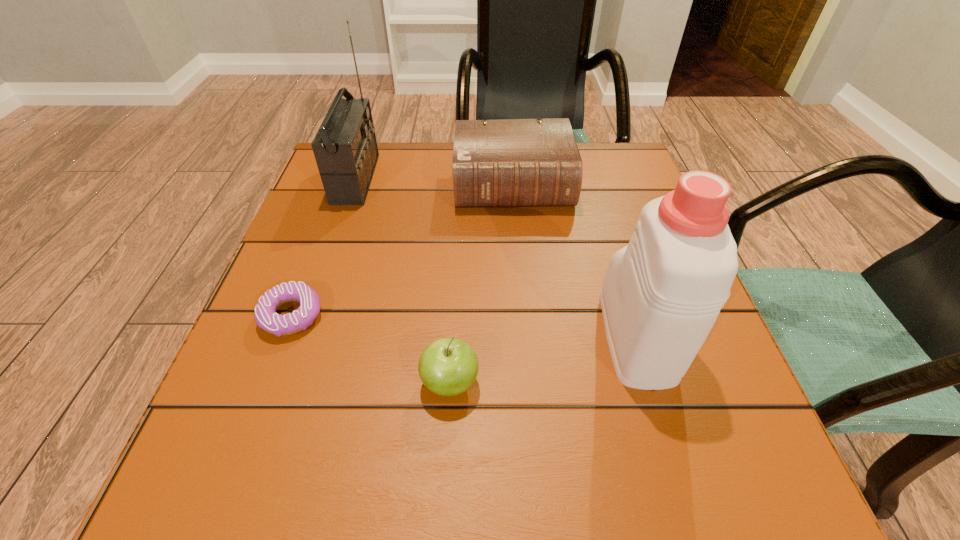
Locate an element on the screen. free point located 0.220m on the left of the apple is located at coordinates (270, 383).

The height and width of the screenshot is (540, 960). I want to click on free space located on the right of the doughnut, so click(x=552, y=316).

Image resolution: width=960 pixels, height=540 pixels. Identify the location of radio receiver present at the far edge. (345, 148).

Find the location of a particular element. This screenshot has height=540, width=960. Bible at the far edge is located at coordinates (513, 162).

The width and height of the screenshot is (960, 540). Find the location of `radio receiver that is at the left edge`. radio receiver that is at the left edge is located at coordinates (345, 148).

This screenshot has height=540, width=960. I want to click on doughnut that is at the left edge, so click(x=265, y=316).

Locate an element on the screen. The image size is (960, 540). object present at the right edge is located at coordinates (662, 293).

What are the coordinates of `object situated at the far left corner` in the screenshot? It's located at [x=345, y=148].

Find the location of a particular element. The image size is (960, 540). free spot at the near edge of the desktop is located at coordinates (628, 491).

Where is `blank space at the left edge`? blank space at the left edge is located at coordinates (324, 330).